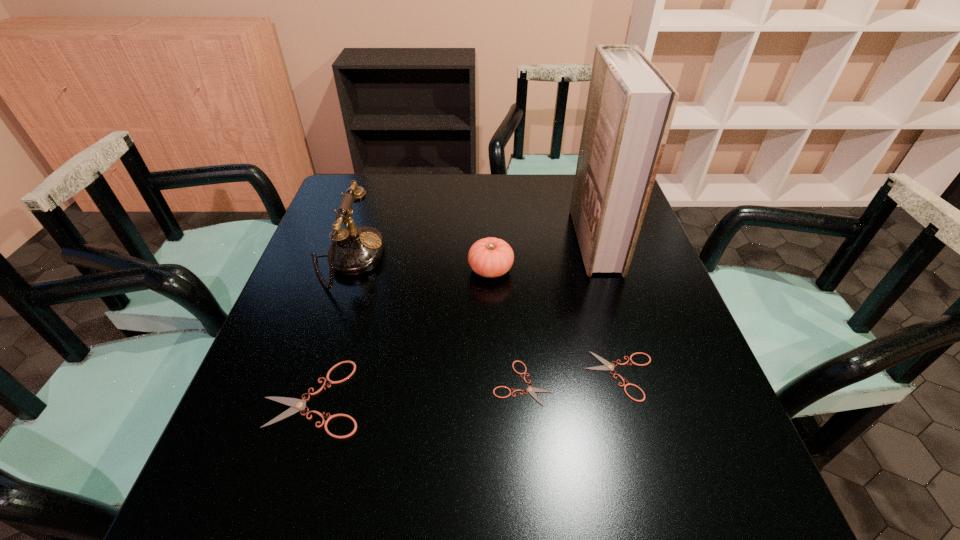
The height and width of the screenshot is (540, 960). In the image, there is a desktop. What are the coordinates of `vacant space at the near right corner` in the screenshot? It's located at (736, 444).

This screenshot has width=960, height=540. What are the coordinates of `free space that is in between the third shortest object and the second tallest object` in the screenshot? It's located at (331, 328).

What are the coordinates of `free point between the tomato and the second shears from left to right` in the screenshot? It's located at (506, 326).

You are a GUI agent. You are given a task and a screenshot of the screen. Output one action in this format:
    pyautogui.click(x=<x>, y=<y>)
    Task: Click on the empty space that is in between the telephone and the tomato
    The height and width of the screenshot is (540, 960).
    Given the screenshot: What is the action you would take?
    pyautogui.click(x=419, y=265)

Where is `empty space that is in between the rightmost shears and the tallest object`? The image size is (960, 540). empty space that is in between the rightmost shears and the tallest object is located at coordinates (608, 308).

What are the coordinates of `blank region between the third shortest object and the tomato` in the screenshot? It's located at (402, 334).

Locate an element on the screen. free space between the shortest shears and the tallest shears is located at coordinates 419,390.

At what (x,y) coordinates should I click in order to perform the action: click on empty space that is in between the fifth tallest object and the telephone. Please return your answer as a coordinate pair (x, y). The width and height of the screenshot is (960, 540). Looking at the image, I should click on (484, 318).

Identify the location of vacant space that's between the second tallest object and the rightmost shears. (484, 318).

You are a GUI agent. You are given a task and a screenshot of the screen. Output one action in this format:
    pyautogui.click(x=<x>, y=<y>)
    Task: Click on the object that is the fifth closest to the second shortest object
    This screenshot has height=540, width=960.
    Given the screenshot: What is the action you would take?
    pyautogui.click(x=356, y=250)